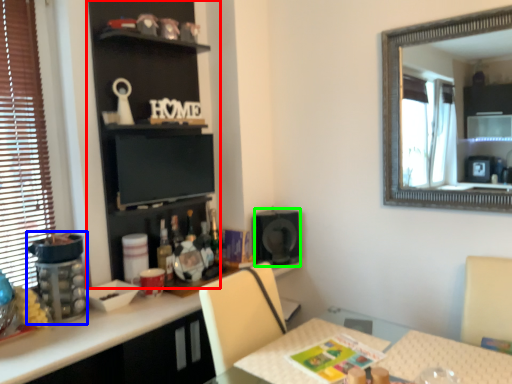
Question: Which is farther away from bookshelf (highlighted by a red box)? appliance (highlighted by a blue box) or speaker (highlighted by a green box)?

Choices:
 (A) appliance
 (B) speaker

Answer: (B)